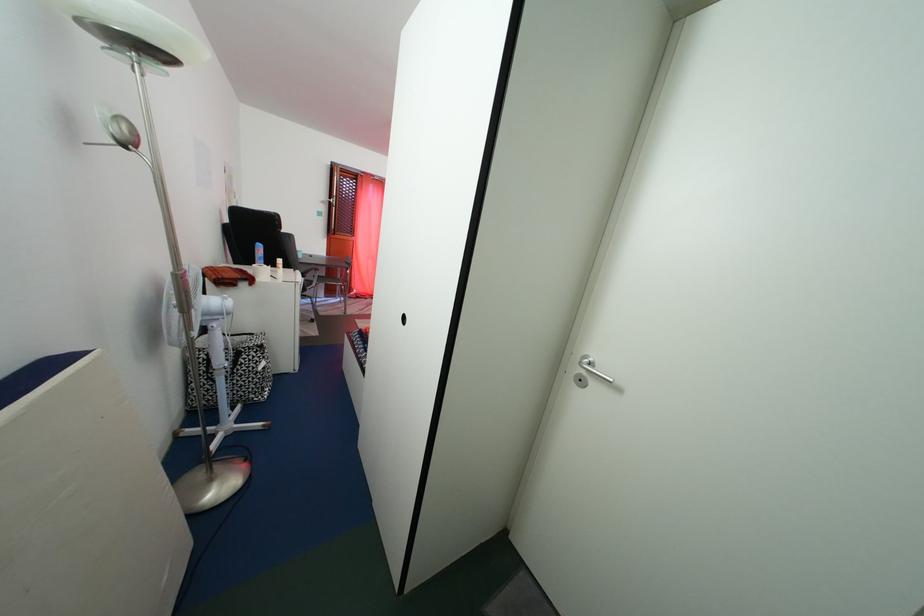
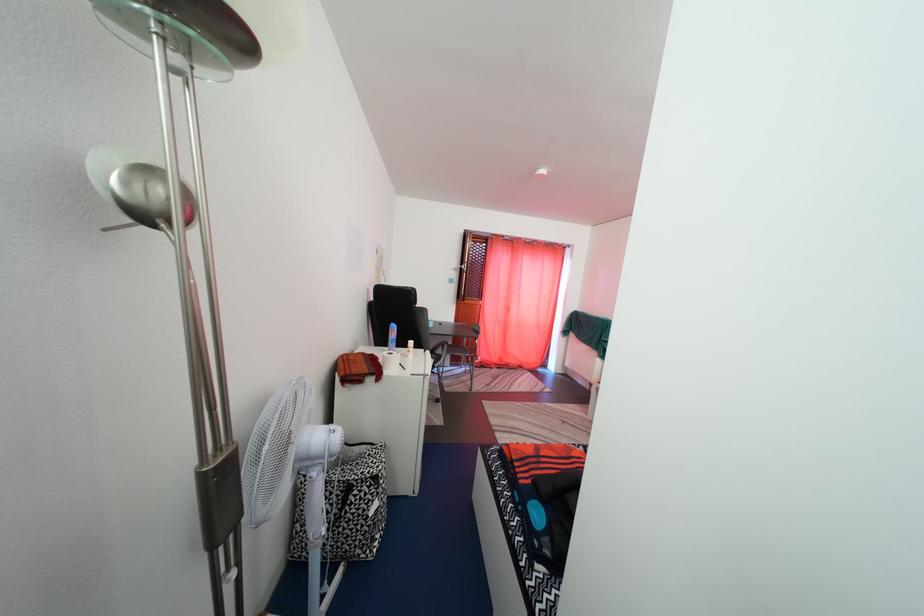
The images are taken continuously from a first-person perspective. In which direction are you moving?

The movement direction of the cameraman is left, forward.